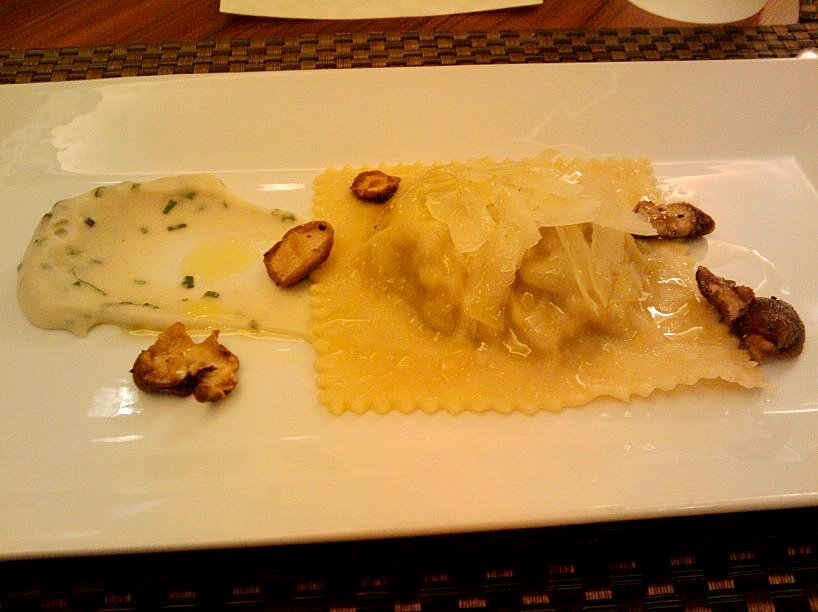
Locate an element on the screen. This screenshot has height=612, width=818. wood grain table top is located at coordinates (129, 16).